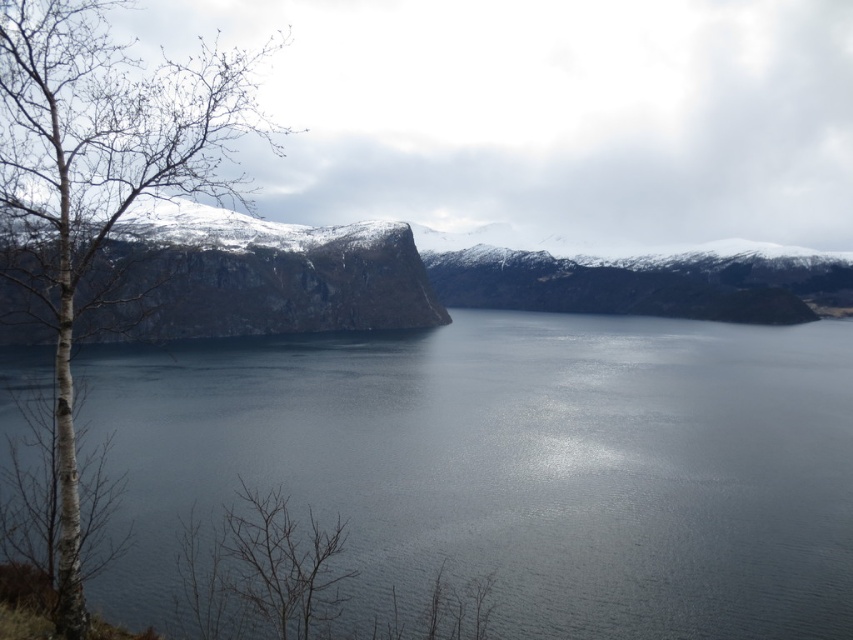
Question: Is dark gray water at center closer to camera compared to snowy rock cliff at left?

Choices:
 (A) yes
 (B) no

Answer: (B)

Question: Which point is farther to the camera?

Choices:
 (A) snowy rock cliff at left
 (B) dark gray water at center

Answer: (B)

Question: Can you confirm if dark gray water at center is positioned above bare bark tree at left?

Choices:
 (A) yes
 (B) no

Answer: (B)

Question: Which is nearer to the snowy rock cliff at left?

Choices:
 (A) bare bark tree at left
 (B) dark gray water at center

Answer: (A)

Question: Which point appears farthest from the camera in this image?

Choices:
 (A) (68, 342)
 (B) (647, 381)

Answer: (B)

Question: Does dark gray water at center have a lesser width compared to snowy rock cliff at left?

Choices:
 (A) no
 (B) yes

Answer: (A)